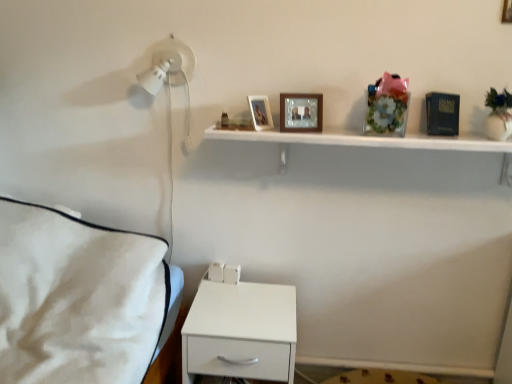
Consider the image. Measure the distance between point (255, 105) and camera.

A distance of 5.12 feet exists between point (255, 105) and camera.

The width and height of the screenshot is (512, 384). I want to click on matte wooden picture frame at upper center, marked as the 2th picture frame in a top-to-bottom arrangement, so click(x=260, y=112).

The width and height of the screenshot is (512, 384). Describe the element at coordinates (301, 112) in the screenshot. I see `wooden picture frame at upper center, arranged as the 2th picture frame when viewed from the right` at that location.

The width and height of the screenshot is (512, 384). What do you see at coordinates (241, 332) in the screenshot?
I see `white matte nightstand at lower center` at bounding box center [241, 332].

Where is `wooden picture frame at upper center, which is the first picture frame from right to left`? This screenshot has height=384, width=512. wooden picture frame at upper center, which is the first picture frame from right to left is located at coordinates (507, 12).

Are wooden picture frame at upper center, which ranks as the first picture frame in bottom-to-top order, and wooden picture frame at upper center, which is the first picture frame from right to left, making contact?

wooden picture frame at upper center, which ranks as the first picture frame in bottom-to-top order, is not next to wooden picture frame at upper center, which is the first picture frame from right to left, and they're not touching.

In the scene shown: Is wooden picture frame at upper center, the 2th picture frame positioned from the left, bigger than wooden picture frame at upper center, acting as the third picture frame starting from the bottom?

Yes.

Choose the correct answer: Is matte wooden picture frame at upper center, acting as the 1th picture frame starting from the left, inside wooden picture frame at upper center, which ranks as the first picture frame in bottom-to-top order, or outside it?

matte wooden picture frame at upper center, acting as the 1th picture frame starting from the left, exists outside the volume of wooden picture frame at upper center, which ranks as the first picture frame in bottom-to-top order.

How much distance is there between matte wooden picture frame at upper center, acting as the 1th picture frame starting from the left, and wooden picture frame at upper center, arranged as the 2th picture frame when viewed from the right?

matte wooden picture frame at upper center, acting as the 1th picture frame starting from the left, and wooden picture frame at upper center, arranged as the 2th picture frame when viewed from the right, are 4.24 inches apart from each other.

Which object is thinner, matte wooden picture frame at upper center, positioned as the 2th picture frame in bottom-to-top order, or wooden picture frame at upper center, the 2th picture frame positioned from the left?

wooden picture frame at upper center, the 2th picture frame positioned from the left, is thinner.

Considering the relative positions of matte wooden picture frame at upper center, acting as the 1th picture frame starting from the left, and wooden picture frame at upper center, the third picture frame positioned from the top, in the image provided, is matte wooden picture frame at upper center, acting as the 1th picture frame starting from the left, to the left or to the right of wooden picture frame at upper center, the third picture frame positioned from the top,?

matte wooden picture frame at upper center, acting as the 1th picture frame starting from the left, is positioned on wooden picture frame at upper center, the third picture frame positioned from the top,'s left side.

Between point (245, 134) and point (282, 99), which one is positioned behind?

The point (282, 99) is more distant.

Is white glossy shelf at upper center oriented towards wooden picture frame at upper center, the 2th picture frame positioned from the left?

No, white glossy shelf at upper center is not turned towards wooden picture frame at upper center, the 2th picture frame positioned from the left.

Is white glossy shelf at upper center to the left or to the right of wooden picture frame at upper center, the third picture frame positioned from the top, in the image?

Clearly, white glossy shelf at upper center is on the right of wooden picture frame at upper center, the third picture frame positioned from the top, in the image.

Which object is more forward, white glossy shelf at upper center or wooden picture frame at upper center, arranged as the 2th picture frame when viewed from the right?

white glossy shelf at upper center.

At what (x,y) coordinates should I click in order to perform the action: click on picture frame on the right of white glossy shelf at upper center. Please return your answer as a coordinate pair (x, y). The image size is (512, 384). Looking at the image, I should click on (507, 12).

Relative to wooden picture frame at upper center, which is the first picture frame from right to left, is white glossy shelf at upper center in front or behind?

In the image, white glossy shelf at upper center appears in front of wooden picture frame at upper center, which is the first picture frame from right to left.

Can you tell me how much white glossy shelf at upper center and wooden picture frame at upper center, positioned as the third picture frame in left-to-right order, differ in facing direction?

There is a 0.834-degree angle between the facing directions of white glossy shelf at upper center and wooden picture frame at upper center, positioned as the third picture frame in left-to-right order.

Who is taller, white glossy shelf at upper center or wooden picture frame at upper center, acting as the third picture frame starting from the bottom?

Standing taller between the two is wooden picture frame at upper center, acting as the third picture frame starting from the bottom.

In terms of height, does white matte nightstand at lower center look taller or shorter compared to white glossy shelf at upper center?

Considering their sizes, white matte nightstand at lower center has more height than white glossy shelf at upper center.

Is white matte nightstand at lower center not within white glossy shelf at upper center?

Yes.

Considering the points (279, 288) and (498, 145), which point is in front, point (279, 288) or point (498, 145)?

The point (498, 145) is more forward.

How different are the orientations of white matte nightstand at lower center and white glossy shelf at upper center in degrees?

white matte nightstand at lower center and white glossy shelf at upper center are facing 0.74 degrees away from each other.

Could you measure the distance between wooden picture frame at upper center, which is the first picture frame from right to left, and white glossy shelf at upper center?

wooden picture frame at upper center, which is the first picture frame from right to left, is 26.94 inches from white glossy shelf at upper center.

From the image's perspective, is wooden picture frame at upper center, acting as the third picture frame starting from the bottom, under white glossy shelf at upper center?

Actually, wooden picture frame at upper center, acting as the third picture frame starting from the bottom, appears above white glossy shelf at upper center in the image.

From a real-world perspective, who is located lower, wooden picture frame at upper center, acting as the third picture frame starting from the bottom, or white glossy shelf at upper center?

white glossy shelf at upper center, from a real-world perspective.

From a real-world perspective, is matte wooden picture frame at upper center, positioned as the 2th picture frame in bottom-to-top order, above or below white matte nightstand at lower center?

matte wooden picture frame at upper center, positioned as the 2th picture frame in bottom-to-top order, is above white matte nightstand at lower center.

Is matte wooden picture frame at upper center, marked as the 2th picture frame in a top-to-bottom arrangement, inside or outside of white matte nightstand at lower center?

matte wooden picture frame at upper center, marked as the 2th picture frame in a top-to-bottom arrangement, is not inside white matte nightstand at lower center, it's outside.

What's the angular difference between matte wooden picture frame at upper center, acting as the 1th picture frame starting from the left, and white matte nightstand at lower center's facing directions?

The angular difference between matte wooden picture frame at upper center, acting as the 1th picture frame starting from the left, and white matte nightstand at lower center is 44.6 degrees.

Is matte wooden picture frame at upper center, positioned as the 2th picture frame in bottom-to-top order, to the right of white matte nightstand at lower center from the viewer's perspective?

Correct, you'll find matte wooden picture frame at upper center, positioned as the 2th picture frame in bottom-to-top order, to the right of white matte nightstand at lower center.

From the image's perspective, which picture frame is the 2nd one below the wooden picture frame at upper center, which is the first picture frame from right to left? Please provide its 2D coordinates.

[(301, 112)]

At what (x,y) coordinates should I click in order to perform the action: click on picture frame that is the 1st one when counting forward from the matte wooden picture frame at upper center, positioned as the 2th picture frame in bottom-to-top order. Please return your answer as a coordinate pair (x, y). This screenshot has height=384, width=512. Looking at the image, I should click on (301, 112).

From the picture: When comparing their distances from white matte nightstand at lower center, does white glossy shelf at upper center or wooden picture frame at upper center, which is the first picture frame from top to bottom, seem further?

Based on the image, wooden picture frame at upper center, which is the first picture frame from top to bottom, appears to be further to white matte nightstand at lower center.

Which object lies further to the anchor point wooden picture frame at upper center, arranged as the 2th picture frame when viewed from the right, white matte nightstand at lower center or white glossy shelf at upper center?

Among the two, white matte nightstand at lower center is located further to wooden picture frame at upper center, arranged as the 2th picture frame when viewed from the right.

Estimate the real-world distances between objects in this image. Which object is closer to white glossy shelf at upper center, wooden picture frame at upper center, arranged as the 2th picture frame when viewed from the right, or matte wooden picture frame at upper center, which appears as the third picture frame when viewed from the right?

wooden picture frame at upper center, arranged as the 2th picture frame when viewed from the right, lies closer to white glossy shelf at upper center than the other object.

Estimate the real-world distances between objects in this image. Which object is closer to wooden picture frame at upper center, acting as the third picture frame starting from the bottom, white matte nightstand at lower center or matte wooden picture frame at upper center, positioned as the 2th picture frame in bottom-to-top order?

matte wooden picture frame at upper center, positioned as the 2th picture frame in bottom-to-top order, lies closer to wooden picture frame at upper center, acting as the third picture frame starting from the bottom, than the other object.

Based on their spatial positions, is white glossy shelf at upper center or matte wooden picture frame at upper center, which appears as the third picture frame when viewed from the right, further from wooden picture frame at upper center, the 2th picture frame positioned from the left?

white glossy shelf at upper center lies further to wooden picture frame at upper center, the 2th picture frame positioned from the left, than the other object.

Which object lies further to the anchor point matte wooden picture frame at upper center, acting as the 1th picture frame starting from the left, white glossy shelf at upper center or wooden picture frame at upper center, the third picture frame positioned from the top?

white glossy shelf at upper center lies further to matte wooden picture frame at upper center, acting as the 1th picture frame starting from the left, than the other object.

Estimate the real-world distances between objects in this image. Which object is closer to matte wooden picture frame at upper center, acting as the 1th picture frame starting from the left, wooden picture frame at upper center, which is the first picture frame from right to left, or white matte nightstand at lower center?

Based on the image, white matte nightstand at lower center appears to be nearer to matte wooden picture frame at upper center, acting as the 1th picture frame starting from the left.

From the picture: Considering their positions, is matte wooden picture frame at upper center, acting as the 1th picture frame starting from the left, positioned closer to wooden picture frame at upper center, arranged as the 2th picture frame when viewed from the right, than wooden picture frame at upper center, positioned as the third picture frame in left-to-right order?

matte wooden picture frame at upper center, acting as the 1th picture frame starting from the left, lies closer to wooden picture frame at upper center, arranged as the 2th picture frame when viewed from the right, than the other object.

Locate an element on the screen. The width and height of the screenshot is (512, 384). shelf between wooden picture frame at upper center, which is the first picture frame from top to bottom, and white matte nightstand at lower center from top to bottom is located at coordinates (371, 143).

Image resolution: width=512 pixels, height=384 pixels. What are the coordinates of `picture frame between matte wooden picture frame at upper center, marked as the 2th picture frame in a top-to-bottom arrangement, and wooden picture frame at upper center, positioned as the third picture frame in left-to-right order, from left to right` in the screenshot? It's located at (301, 112).

I want to click on shelf between wooden picture frame at upper center, the 2th picture frame positioned from the left, and wooden picture frame at upper center, acting as the third picture frame starting from the bottom, so click(371, 143).

Where is `picture frame between matte wooden picture frame at upper center, which appears as the third picture frame when viewed from the right, and white matte nightstand at lower center, in the vertical direction`? picture frame between matte wooden picture frame at upper center, which appears as the third picture frame when viewed from the right, and white matte nightstand at lower center, in the vertical direction is located at coordinates (301, 112).